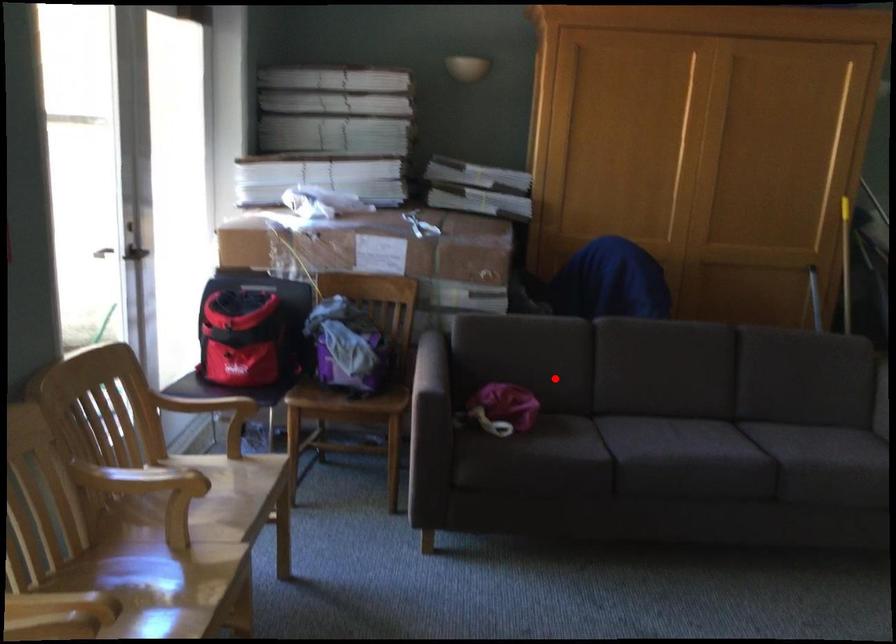
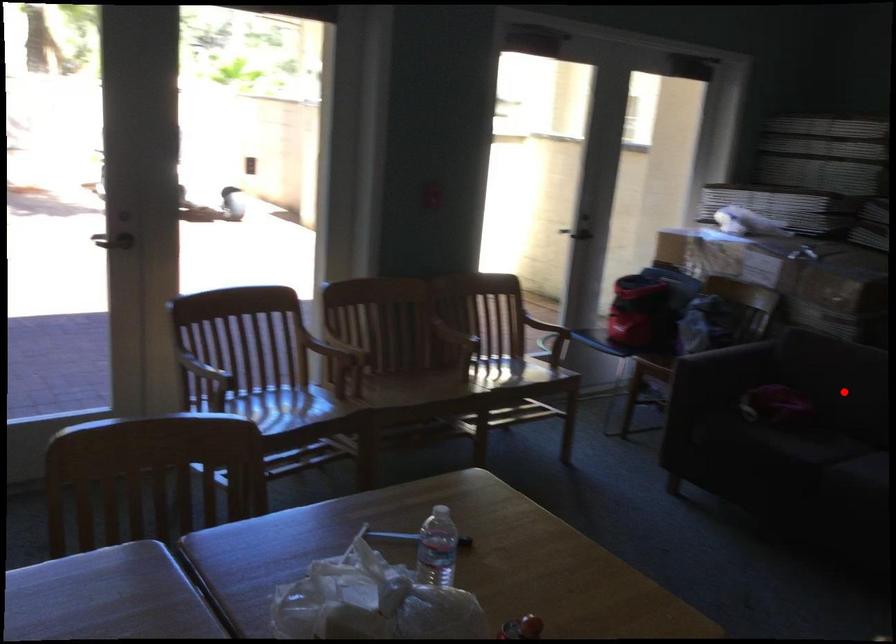
I am providing you with two images of the same scene from different viewpoints. A red point is marked on the first image and another point is marked on the second image. Are the points marked in image1 and image2 representing the same 3D position?

Yes